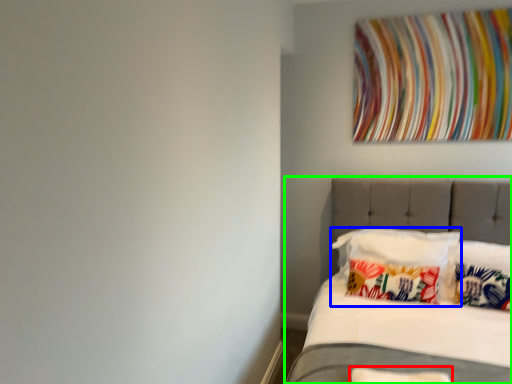
Question: Considering the real-world distances, which object is farthest from pillow (highlighted by a red box)? pillow (highlighted by a blue box) or bed (highlighted by a green box)?

Choices:
 (A) pillow
 (B) bed

Answer: (B)